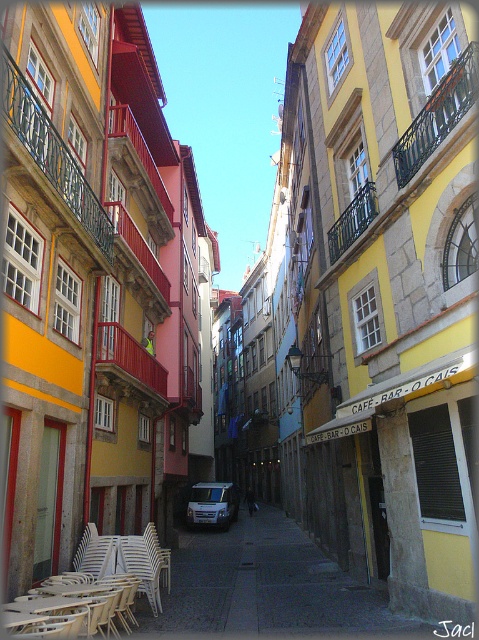
Is white plastic chairs at lower left smaller than white matte van at center?

Yes.

Is white plastic chairs at lower left to the left of white matte van at center from the viewer's perspective?

Yes, white plastic chairs at lower left is to the left of white matte van at center.

Between point (169, 564) and point (227, 502), which one is positioned behind?

Positioned behind is point (227, 502).

Where is `white plastic chairs at lower left`? This screenshot has width=479, height=640. white plastic chairs at lower left is located at coordinates (94, 588).